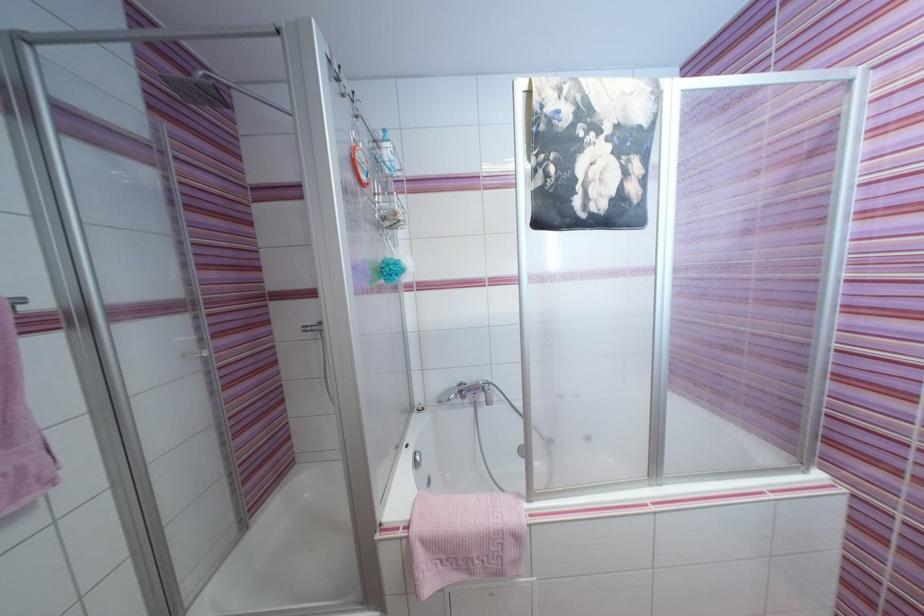
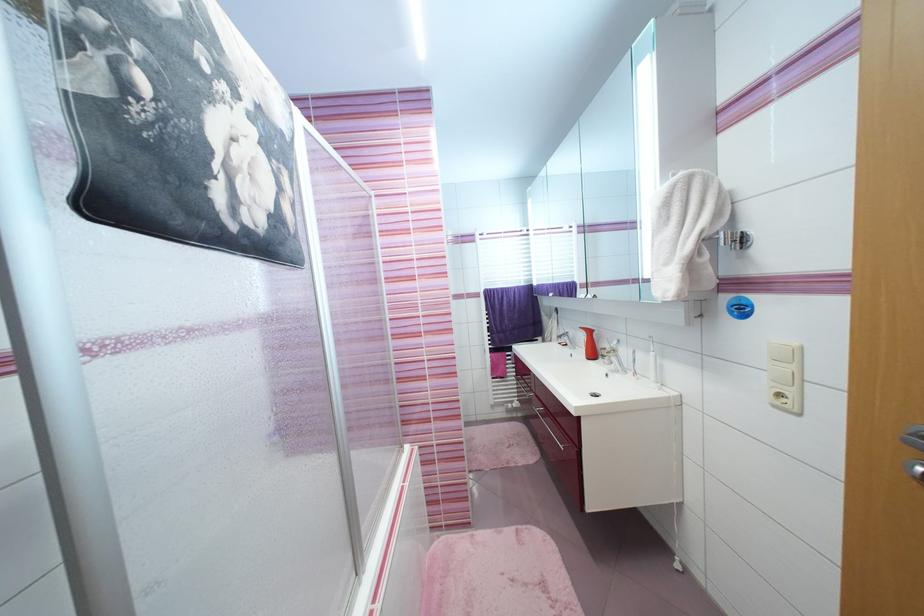
Question: The camera is either moving clockwise (left) or counter-clockwise (right) around the object. The first image is from the beginning of the video and the second image is from the end. Is the camera moving left or right when shooting the video?

Choices:
 (A) Left
 (B) Right

Answer: (A)